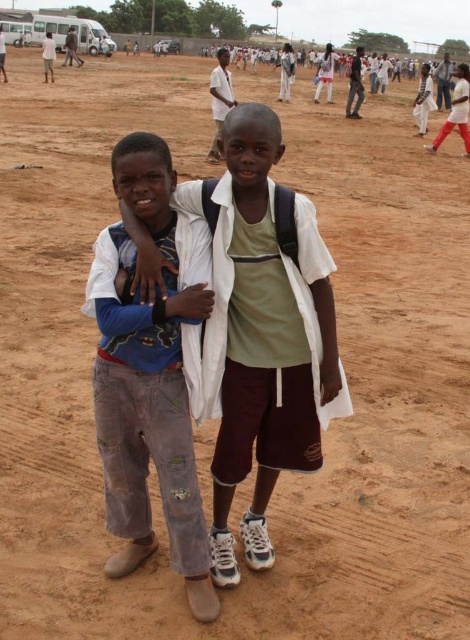
Question: Which of the following is the farthest from the observer?

Choices:
 (A) (198, 612)
 (B) (141, 250)

Answer: (A)

Question: Can you confirm if light brown cotton shirt at center is thinner than washed denim pants at center?

Choices:
 (A) yes
 (B) no

Answer: (B)

Question: Among these points, which one is farthest from the camera?

Choices:
 (A) (307, 272)
 (B) (190, 268)

Answer: (B)

Question: Is light brown cotton shirt at center further to camera compared to washed denim pants at center?

Choices:
 (A) no
 (B) yes

Answer: (B)

Question: Is light brown cotton shirt at center positioned behind washed denim pants at center?

Choices:
 (A) no
 (B) yes

Answer: (B)